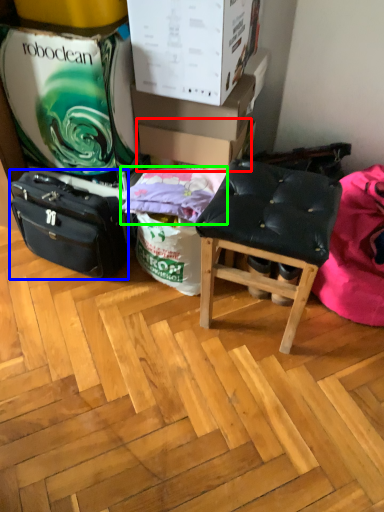
Question: Which is nearer to the cardboard box (highlighted by a red box)? luggage and bags (highlighted by a blue box) or pillow (highlighted by a green box).

Choices:
 (A) luggage and bags
 (B) pillow

Answer: (B)